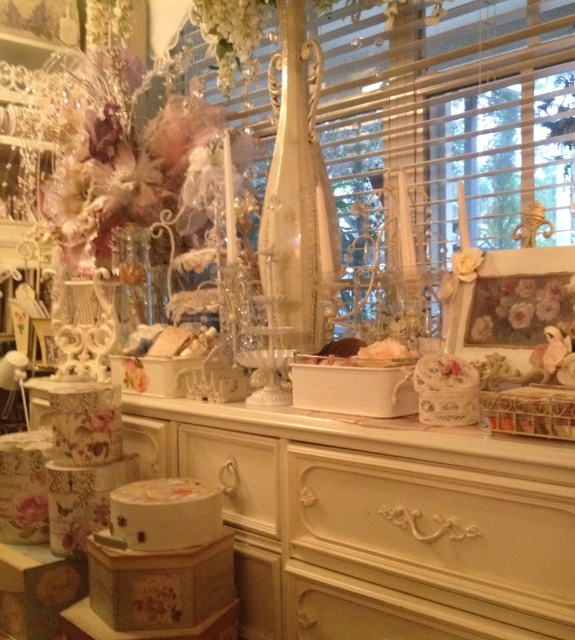
You are a customer in a shop looking at the display. You see the white carved drawer at center and the white wood drawer at center. Which one is placed higher?

The white wood drawer at center is placed higher because the white carved drawer at center is positioned under it.